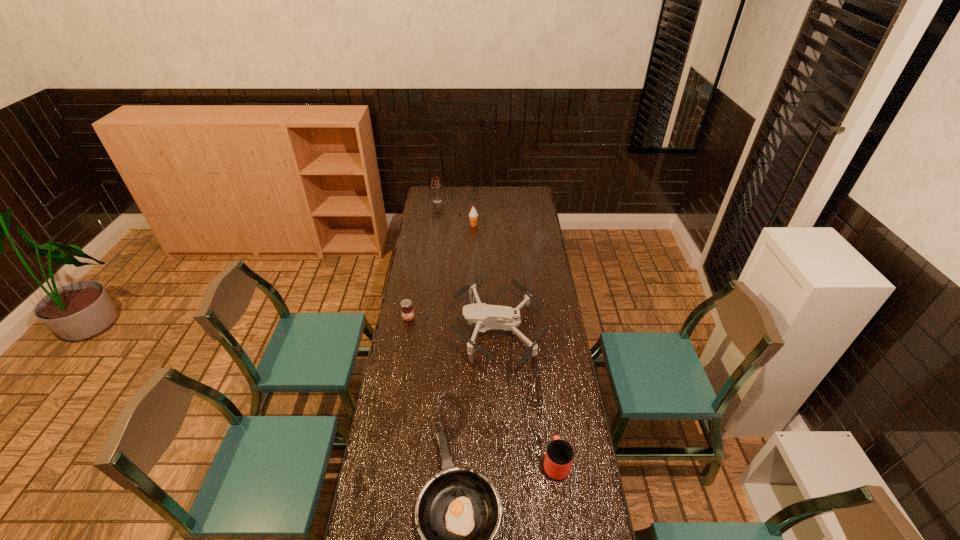
Locate which object ranks in proximity to the jam. Please provide its 2D coordinates. Your answer should be formatted as a tuple, i.e. [(x, y)], where the tuple contains the x and y coordinates of a point satisfying the conditions above.

[(485, 317)]

Identify which object is the third closest to the drone. Please provide its 2D coordinates. Your answer should be formatted as a tuple, i.e. [(x, y)], where the tuple contains the x and y coordinates of a point satisfying the conditions above.

[(559, 455)]